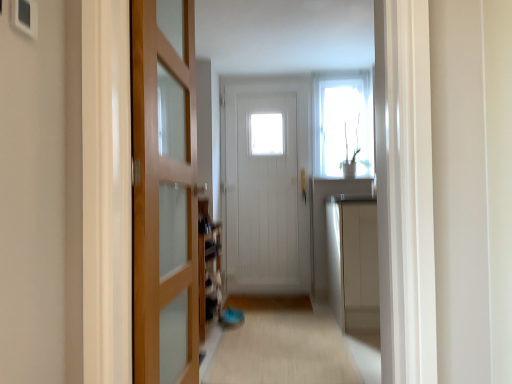
What do you see at coordinates (266, 194) in the screenshot? Image resolution: width=512 pixels, height=384 pixels. I see `white wooden door at center, which is the 2th door in front-to-back order` at bounding box center [266, 194].

You are a GUI agent. You are given a task and a screenshot of the screen. Output one action in this format:
    pyautogui.click(x=<x>, y=<y>)
    Task: Click on the white glossy window at upper center
    This screenshot has height=384, width=512.
    Given the screenshot: What is the action you would take?
    pyautogui.click(x=343, y=123)

Image resolution: width=512 pixels, height=384 pixels. What do you see at coordinates (164, 192) in the screenshot? I see `wooden door at left, the 1th door in the front-to-back sequence` at bounding box center [164, 192].

The image size is (512, 384). Find the location of `white wooden door at center, which is the 2th door in front-to-back order`. white wooden door at center, which is the 2th door in front-to-back order is located at coordinates (x=266, y=194).

Consider the image. Considering the sizes of objects wooden door at left, the first door in the left-to-right sequence, and beige carpet at center in the image provided, who is smaller, wooden door at left, the first door in the left-to-right sequence, or beige carpet at center?

Smaller between the two is beige carpet at center.

Identify the location of alley below the wooden door at left, the 1th door in the front-to-back sequence (from the image's perspective). (280, 345).

Are wooden door at left, which is the second door in right-to-left order, and beige carpet at center far apart?

That's not correct — wooden door at left, which is the second door in right-to-left order, is a little close to beige carpet at center.

Consider the image. Who is smaller, beige carpet at center or white glossy window at upper center?

white glossy window at upper center.

Looking at this image, is beige carpet at center in contact with white glossy window at upper center?

beige carpet at center and white glossy window at upper center are not in contact.

Does beige carpet at center turn towards white glossy window at upper center?

No.

From the image's perspective, which is below, beige carpet at center or white glossy window at upper center?

beige carpet at center appears lower in the image.

In the image, is white glossy window at upper center on the left side or the right side of beige carpet at center?

white glossy window at upper center is positioned on beige carpet at center's right side.

Does white glossy window at upper center contain beige carpet at center?

Definitely not — beige carpet at center is not inside white glossy window at upper center.

Which point is more distant from viewer, (x=355, y=148) or (x=227, y=375)?

The point (x=355, y=148) is farther.

Is white glossy window at upper center looking in the opposite direction of beige carpet at center?

white glossy window at upper center does not have its back to beige carpet at center.

Is there a large distance between beige carpet at center and white wooden door at center, the first door from the right?

Absolutely, beige carpet at center is distant from white wooden door at center, the first door from the right.

Can you tell me how much beige carpet at center and white wooden door at center, the first door from the right, differ in facing direction?

The facing directions of beige carpet at center and white wooden door at center, the first door from the right, are 90 degrees apart.

Which is correct: beige carpet at center is inside white wooden door at center, which is the 2th door in front-to-back order, or outside of it?

beige carpet at center is located beyond the bounds of white wooden door at center, which is the 2th door in front-to-back order.

Which object is wider, white wooden door at center, the 2th door when ordered from left to right, or white glossy window at upper center?

With larger width is white wooden door at center, the 2th door when ordered from left to right.

Based on the photo, considering the relative positions of white wooden door at center, acting as the first door starting from the back, and white glossy window at upper center in the image provided, is white wooden door at center, acting as the first door starting from the back, in front of white glossy window at upper center?

Yes, white wooden door at center, acting as the first door starting from the back, is closer to the viewer.

Is point (246, 285) closer to viewer compared to point (365, 84)?

No, it is not.

Where is `door that is the 1st object located in front of the white glossy window at upper center`? Image resolution: width=512 pixels, height=384 pixels. door that is the 1st object located in front of the white glossy window at upper center is located at coordinates (266, 194).

From the picture: Is white wooden door at center, the first door from the right, located outside beige carpet at center?

white wooden door at center, the first door from the right, lies outside beige carpet at center's area.

Does white wooden door at center, the 2th door when ordered from left to right, touch beige carpet at center?

No, white wooden door at center, the 2th door when ordered from left to right, is not in contact with beige carpet at center.

Which is more to the left, white wooden door at center, the 2th door when ordered from left to right, or beige carpet at center?

white wooden door at center, the 2th door when ordered from left to right.

Is white wooden door at center, acting as the first door starting from the back, aimed at beige carpet at center?

Yes, white wooden door at center, acting as the first door starting from the back, is turned towards beige carpet at center.

In the scene shown: Is white glossy window at upper center far away from white wooden door at center, the first door from the right?

white glossy window at upper center is actually quite close to white wooden door at center, the first door from the right.

Based on the photo, from a real-world perspective, is white glossy window at upper center located beneath white wooden door at center, the first door from the right?

Answer: Actually, white glossy window at upper center is physically above white wooden door at center, the first door from the right, in the real world.

Which is more to the left, white glossy window at upper center or white wooden door at center, which is the 2th door in front-to-back order?

white wooden door at center, which is the 2th door in front-to-back order, is more to the left.

Can you confirm if white glossy window at upper center is taller than white wooden door at center, the first door from the right?

Incorrect, the height of white glossy window at upper center is not larger of that of white wooden door at center, the first door from the right.

This screenshot has width=512, height=384. I want to click on alley on the right of wooden door at left, which is counted as the 2th door, starting from the back, so click(x=280, y=345).

The height and width of the screenshot is (384, 512). Find the location of `window behind the beige carpet at center`. window behind the beige carpet at center is located at coordinates (343, 123).

Estimate the real-world distances between objects in this image. Which object is closer to wooden door at left, the first door in the left-to-right sequence, white wooden door at center, which is the 2th door in front-to-back order, or beige carpet at center?

The object closer to wooden door at left, the first door in the left-to-right sequence, is beige carpet at center.

Looking at the image, which one is located further to beige carpet at center, white glossy window at upper center or wooden door at left, the first door in the left-to-right sequence?

Among the two, white glossy window at upper center is located further to beige carpet at center.

Consider the image. When comparing their distances from white glossy window at upper center, does white wooden door at center, the 2th door when ordered from left to right, or beige carpet at center seem closer?

Among the two, white wooden door at center, the 2th door when ordered from left to right, is located nearer to white glossy window at upper center.

Looking at the image, which one is located further to wooden door at left, the 1th door in the front-to-back sequence, white glossy window at upper center or beige carpet at center?

white glossy window at upper center lies further to wooden door at left, the 1th door in the front-to-back sequence, than the other object.

Which object lies further to the anchor point beige carpet at center, white wooden door at center, the first door from the right, or white glossy window at upper center?

white glossy window at upper center is further to beige carpet at center.

Based on their spatial positions, is beige carpet at center or white wooden door at center, the 2th door when ordered from left to right, closer to white glossy window at upper center?

Among the two, white wooden door at center, the 2th door when ordered from left to right, is located nearer to white glossy window at upper center.

When comparing their distances from white wooden door at center, which is the 2th door in front-to-back order, does white glossy window at upper center or beige carpet at center seem further?

beige carpet at center lies further to white wooden door at center, which is the 2th door in front-to-back order, than the other object.

Considering their positions, is white glossy window at upper center positioned further to beige carpet at center than white wooden door at center, acting as the first door starting from the back?

Among the two, white glossy window at upper center is located further to beige carpet at center.

You are a GUI agent. You are given a task and a screenshot of the screen. Output one action in this format:
    pyautogui.click(x=<x>, y=<y>)
    Task: Click on the door between beige carpet at center and white glossy window at upper center in the front-back direction
    This screenshot has width=512, height=384.
    Given the screenshot: What is the action you would take?
    pyautogui.click(x=266, y=194)

Find the location of a particular element. alley positioned between wooden door at left, the first door in the left-to-right sequence, and white glossy window at upper center from near to far is located at coordinates (280, 345).

Locate an element on the screen. The height and width of the screenshot is (384, 512). door positioned between wooden door at left, the first door in the left-to-right sequence, and white glossy window at upper center from near to far is located at coordinates (266, 194).

Find the location of a particular element. The image size is (512, 384). alley located between wooden door at left, which is counted as the 2th door, starting from the back, and white wooden door at center, the first door from the right, in the depth direction is located at coordinates (280, 345).